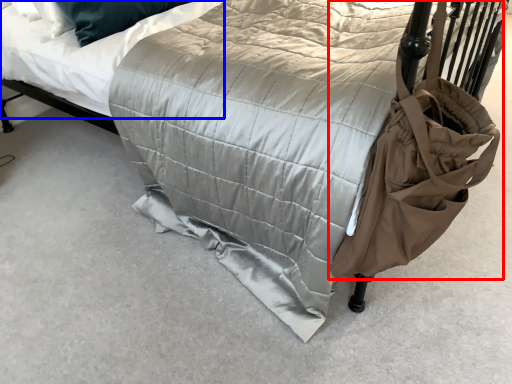
Question: Among these objects, which one is nearest to the camera, bag (highlighted by a red box) or mattress (highlighted by a blue box)?

Choices:
 (A) bag
 (B) mattress

Answer: (A)